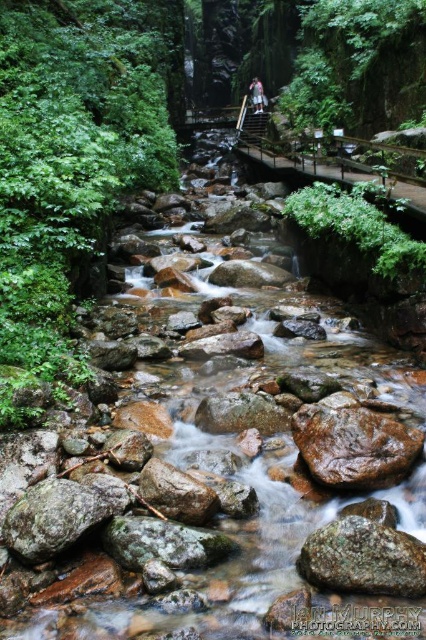
Question: In this image, where is green mossy rock at lower left located relative to smooth gray rock at center?

Choices:
 (A) below
 (B) above

Answer: (A)

Question: Considering the real-world distances, which object is closest to the smooth gray rock at center?

Choices:
 (A) rusty metallic rock at center
 (B) white fabric shirt at center
 (C) smooth brown rock at center
 (D) green mossy rock at lower left

Answer: (C)

Question: Is the position of rusty metallic rock at center more distant than that of smooth gray rock at center?

Choices:
 (A) yes
 (B) no

Answer: (B)

Question: Which point is closer to the camera?

Choices:
 (A) smooth brown rock at center
 (B) rusty metallic rock at center
 (C) smooth gray rock at center
 (D) brown rough rock at center

Answer: (B)

Question: Estimate the real-world distances between objects in this image. Which object is closer to the green mossy rock at center?

Choices:
 (A) rusty metallic rock at center
 (B) brown rough rock at center
 (C) green mossy rock at lower left

Answer: (C)

Question: Is green mossy rock at center smaller than smooth brown rock at center?

Choices:
 (A) no
 (B) yes

Answer: (B)